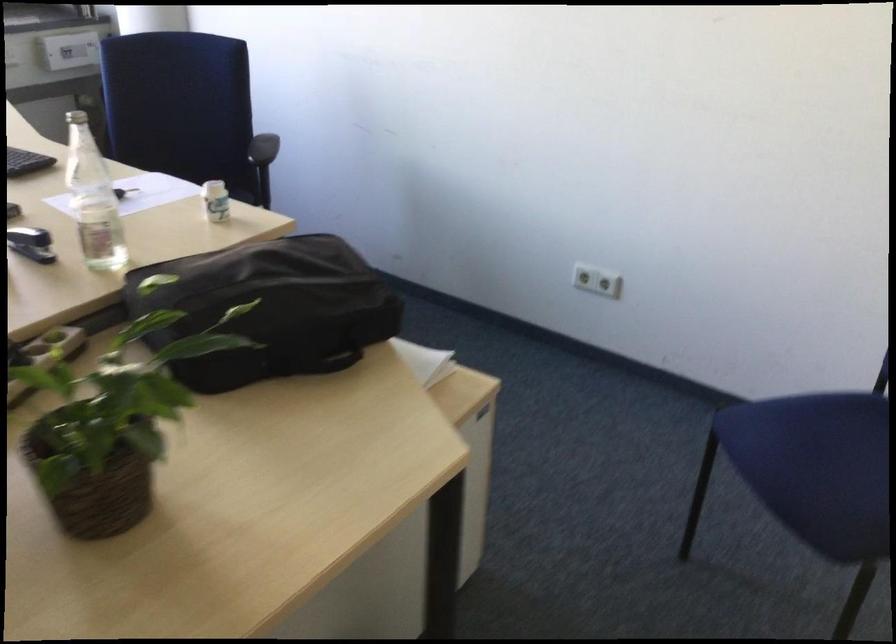
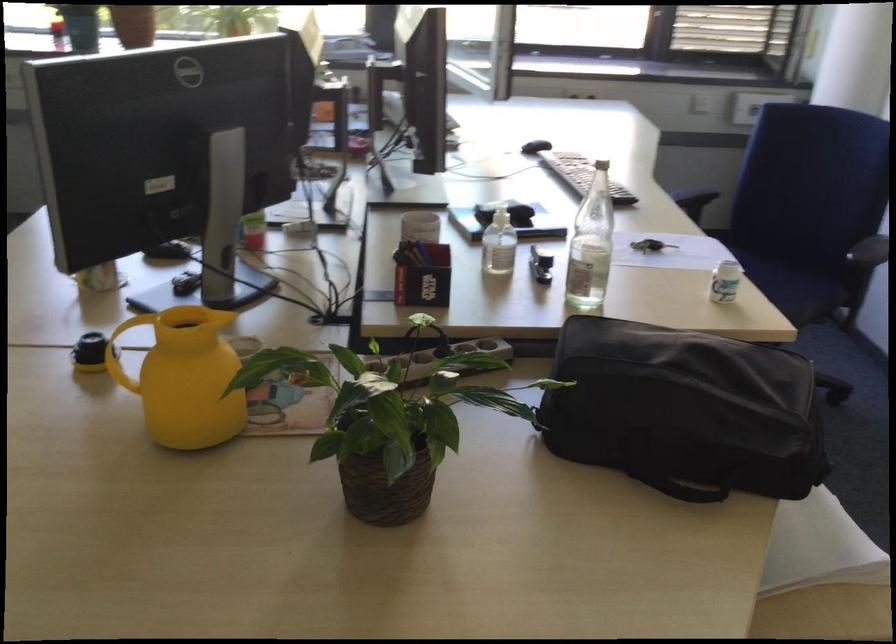
Find the pixel in the second image that matches (346,361) in the first image.

(694, 491)